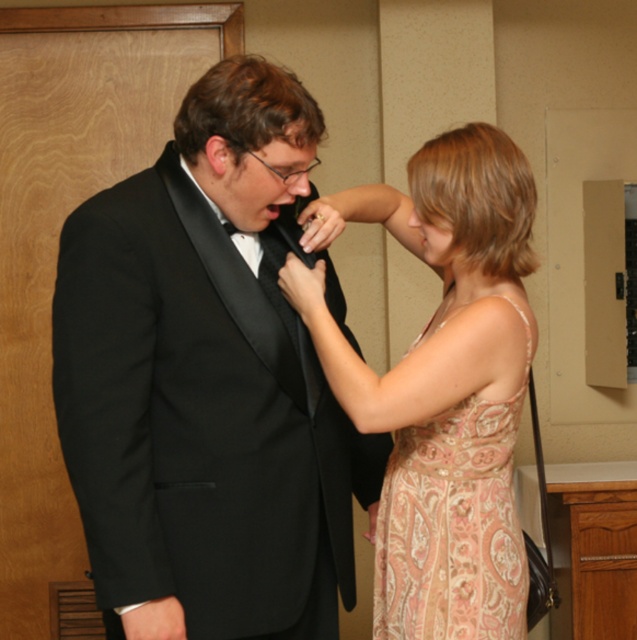
Question: Which object is positioned closest to the paisley silk dress at center?

Choices:
 (A) black satin tuxedo at center
 (B) paisley-patterned fabric dress at center

Answer: (B)

Question: Does paisley silk dress at center appear over black satin bow tie at center?

Choices:
 (A) yes
 (B) no

Answer: (B)

Question: Is the position of paisley-patterned fabric dress at center less distant than that of black satin bow tie at center?

Choices:
 (A) yes
 (B) no

Answer: (A)

Question: From the image, what is the correct spatial relationship of paisley-patterned fabric dress at center in relation to black satin bow tie at center?

Choices:
 (A) below
 (B) above

Answer: (A)

Question: Which object appears farthest from the camera in this image?

Choices:
 (A) paisley silk dress at center
 (B) paisley-patterned fabric dress at center
 (C) black satin bow tie at center
 (D) black satin tuxedo at center

Answer: (C)

Question: Which object appears farthest from the camera in this image?

Choices:
 (A) black satin bow tie at center
 (B) paisley-patterned fabric dress at center

Answer: (A)